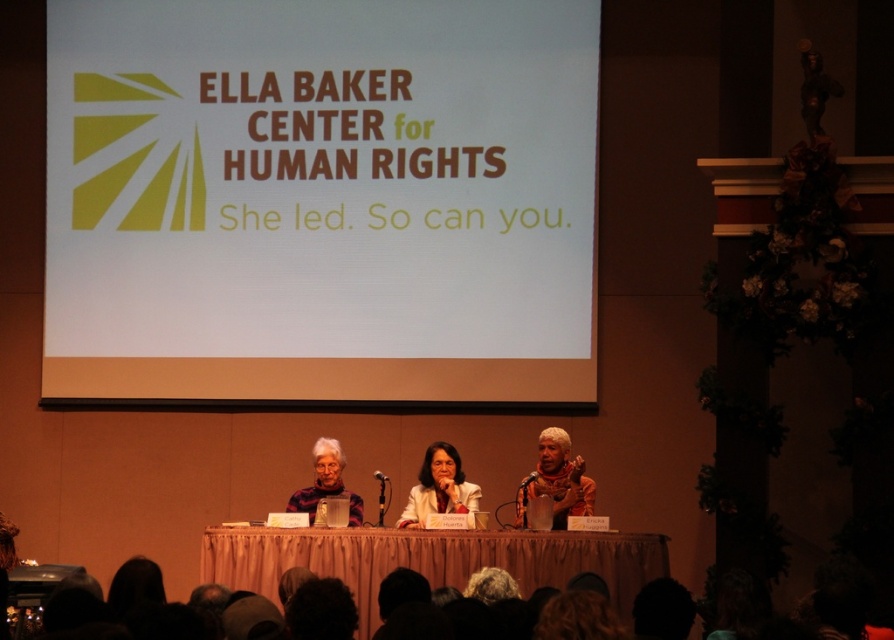
Question: Which of these objects is positioned closest to the silky brown scarf at center?

Choices:
 (A) smooth beige table at center
 (B) white paper at center
 (C) matte white shirt at center

Answer: (C)

Question: Where is matte white shirt at center located in relation to matte black sweater at center in the image?

Choices:
 (A) below
 (B) above

Answer: (A)

Question: Which of the following is the farthest from the observer?

Choices:
 (A) matte white shirt at center
 (B) matte black sweater at center

Answer: (B)

Question: Can you confirm if smooth beige table at center is thinner than silky brown scarf at center?

Choices:
 (A) no
 (B) yes

Answer: (A)

Question: Which object is the closest to the matte black sweater at center?

Choices:
 (A) white paper at center
 (B) silky brown scarf at center
 (C) smooth beige table at center

Answer: (C)

Question: Is smooth beige table at center above matte black sweater at center?

Choices:
 (A) yes
 (B) no

Answer: (B)